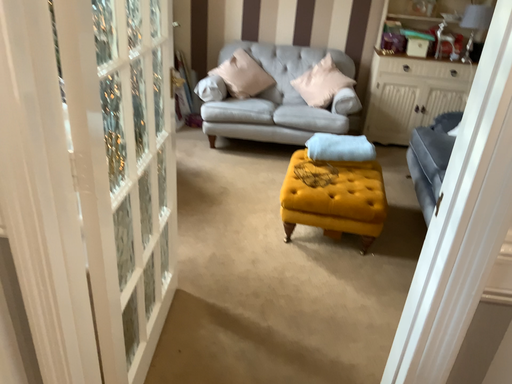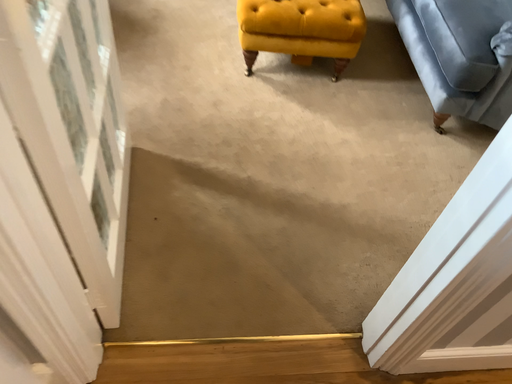
Question: How did the camera likely rotate when shooting the video?

Choices:
 (A) rotated left
 (B) rotated right

Answer: (B)